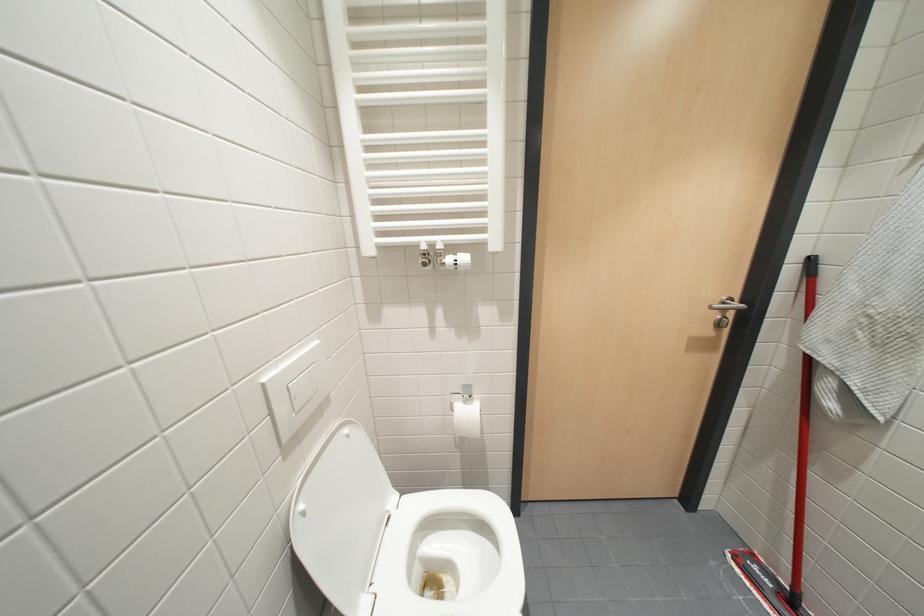
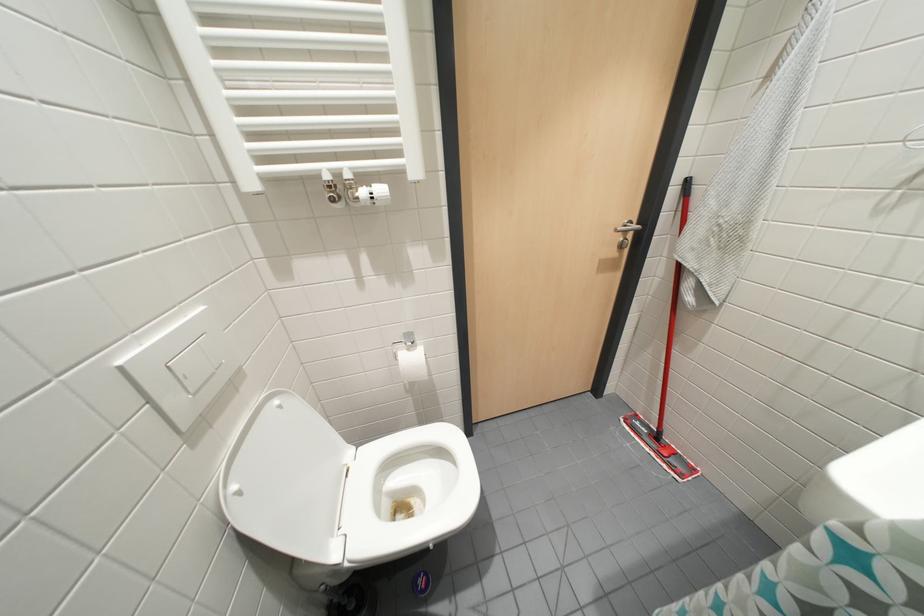
Question: Based on the continuous images, in which direction is the camera rotating? Reply with the corresponding letter.

Choices:
 (A) Left
 (B) Right
 (C) Up
 (D) Down

Answer: (B)